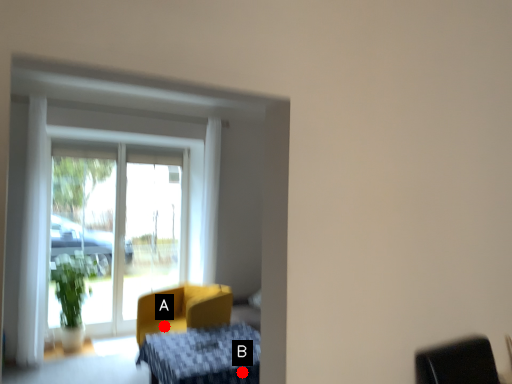
Question: Two points are circled on the image, labeled by A and B beside each circle. Which point is closer to the camera taking this photo?

Choices:
 (A) A is closer
 (B) B is closer

Answer: (B)